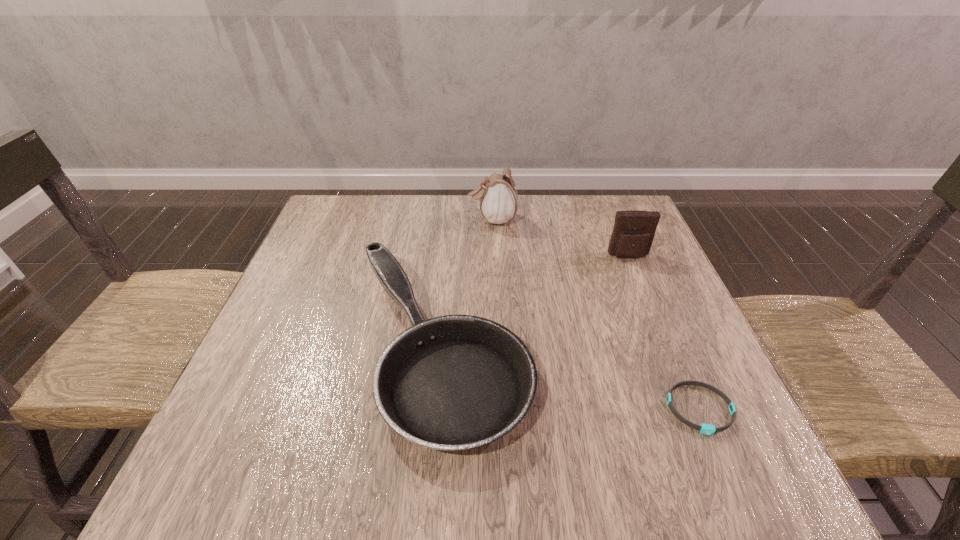
Find the location of a particular element. free region located 0.190m on the left of the second shortest object is located at coordinates (256, 347).

Locate an element on the screen. The image size is (960, 540). free space located 0.080m on the buckle of the shortest object is located at coordinates (732, 484).

This screenshot has height=540, width=960. I want to click on object located in the far edge section of the desktop, so click(498, 202).

Locate an element on the screen. object located in the near edge section of the desktop is located at coordinates (456, 382).

Where is `pouch located in the right edge section of the desktop`? The image size is (960, 540). pouch located in the right edge section of the desktop is located at coordinates (634, 230).

Locate an element on the screen. wristband that is at the right edge is located at coordinates (707, 429).

Find the location of a particular element. This screenshot has width=960, height=540. free space at the far edge is located at coordinates (527, 226).

Image resolution: width=960 pixels, height=540 pixels. In the image, there is a desktop. Find the location of `vacant space at the left edge`. vacant space at the left edge is located at coordinates (280, 298).

At what (x,y) coordinates should I click in order to perform the action: click on free region at the right edge of the desktop. Please return your answer as a coordinate pair (x, y). Looking at the image, I should click on (660, 403).

You are a GUI agent. You are given a task and a screenshot of the screen. Output one action in this format:
    pyautogui.click(x=<x>, y=<y>)
    Task: Click on the vacant space at the far left corner of the desktop
    
    Given the screenshot: What is the action you would take?
    pyautogui.click(x=379, y=203)